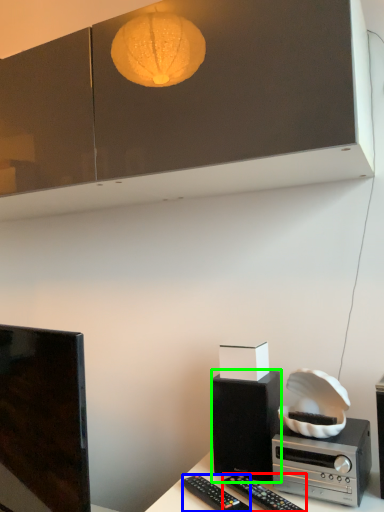
Question: Considering the real-world distances, which object is farthest from remote control (highlighted by a red box)? remote control (highlighted by a blue box) or loudspeaker (highlighted by a green box)?

Choices:
 (A) remote control
 (B) loudspeaker

Answer: (B)